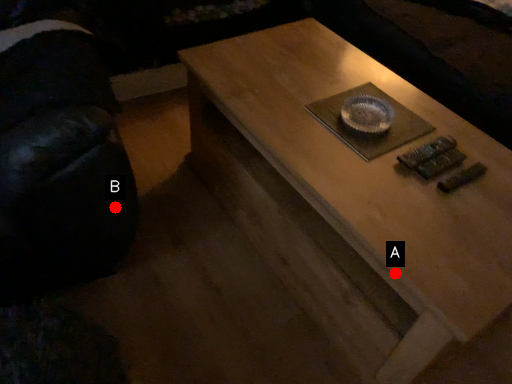
Question: Two points are circled on the image, labeled by A and B beside each circle. Among these points, which one is nearest to the camera?

Choices:
 (A) A is closer
 (B) B is closer

Answer: (A)